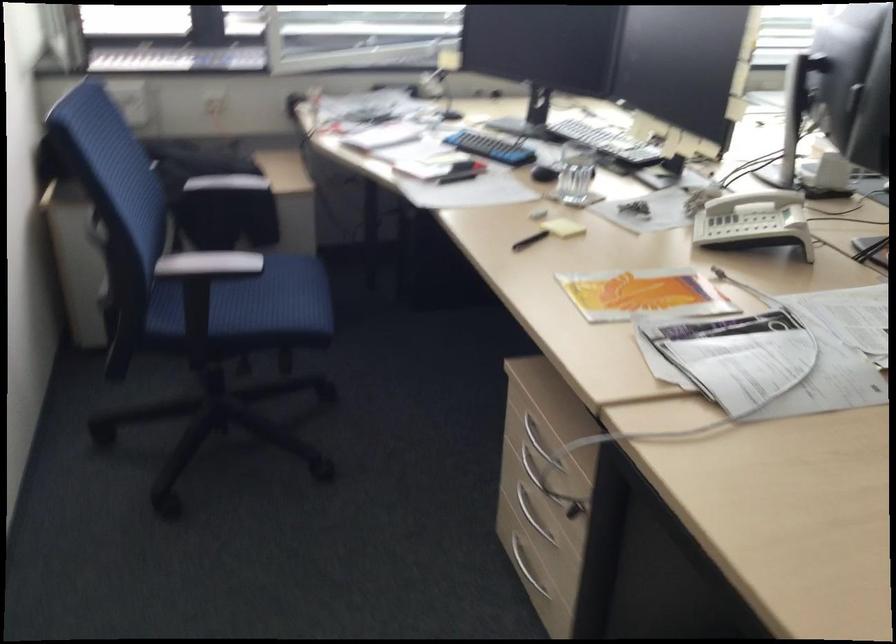
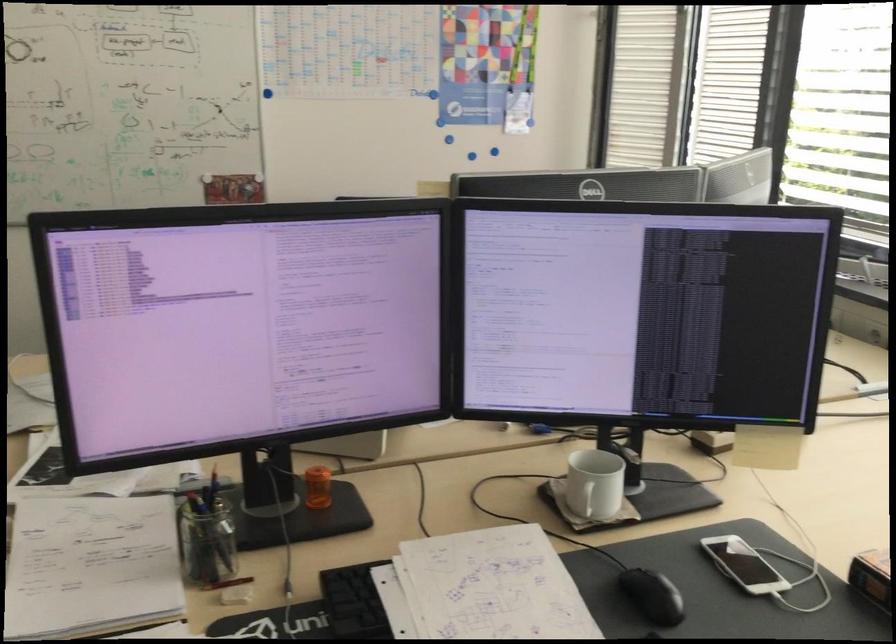
Question: I am providing you with two images of the same scene from different viewpoints. Please identify which objects are invisible in image2.

Choices:
 (A) blue push pin
 (B) silver drawer handle
 (C) brown paper folder
 (D) white mug handle

Answer: (B)